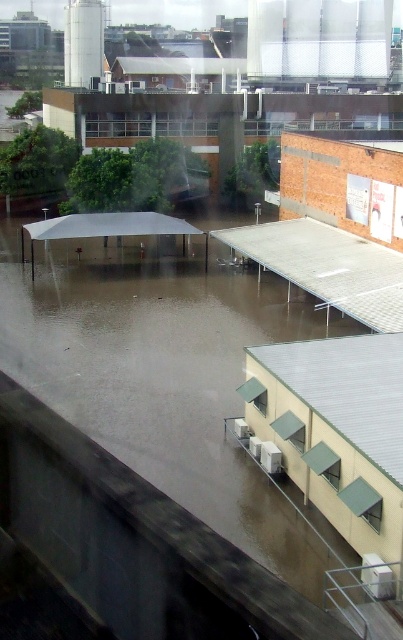
You are standing at the edge of the flooded area and want to cross to the other side. There is a point marked at coordinates (166, 378) in the center of the image. What is located at that point?

At point (166, 378) lies brown muddy water at center, so the point is covered by brown muddy water.